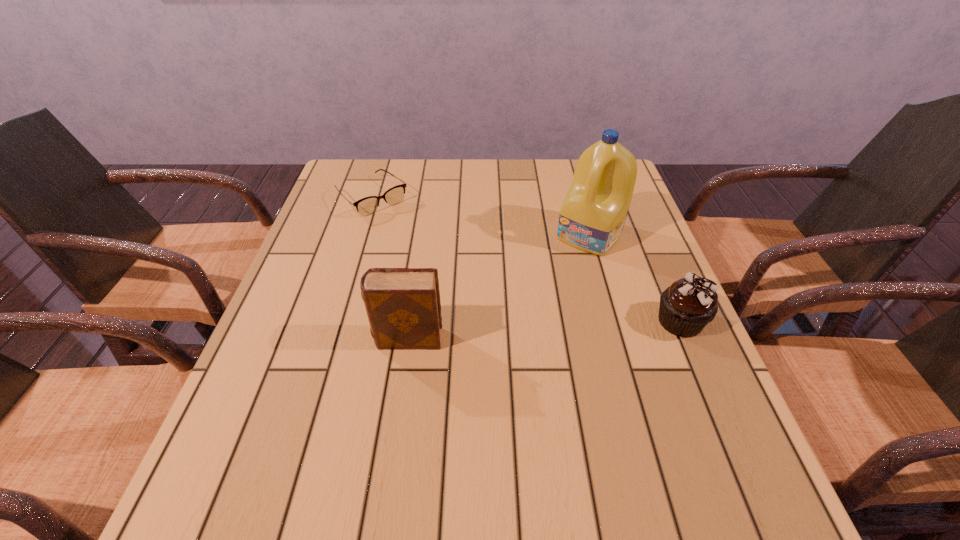
Find the location of a particular element. This screenshot has width=960, height=540. vacant space located on the face of the spectacles is located at coordinates (464, 287).

What are the coordinates of `vacant area situated on the label of the tallest object` in the screenshot? It's located at (516, 325).

Where is `vacant space located 0.080m on the label of the tallest object`? The width and height of the screenshot is (960, 540). vacant space located 0.080m on the label of the tallest object is located at coordinates (560, 271).

At what (x,y) coordinates should I click in order to perform the action: click on vacant region located 0.240m on the label of the tallest object. Please return your answer as a coordinate pair (x, y). The image size is (960, 540). Looking at the image, I should click on (527, 310).

The width and height of the screenshot is (960, 540). What are the coordinates of `object located at the far edge` in the screenshot? It's located at (366, 206).

This screenshot has width=960, height=540. I want to click on object that is at the left edge, so click(366, 206).

The height and width of the screenshot is (540, 960). I want to click on cupcake located at the right edge, so click(x=689, y=304).

Image resolution: width=960 pixels, height=540 pixels. I want to click on detergent that is at the right edge, so click(x=592, y=216).

Where is `object that is at the far left corner`? This screenshot has height=540, width=960. object that is at the far left corner is located at coordinates (366, 206).

Where is `vacant space at the far edge`? vacant space at the far edge is located at coordinates (423, 160).